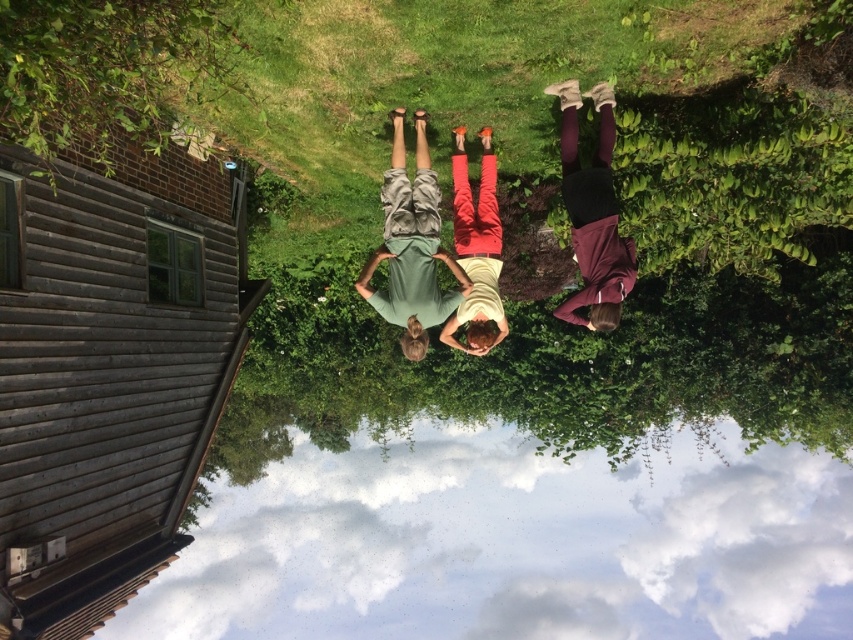
Is maroon fabric pants at center further to the viewer compared to matte yellow shirt at center?

No, it is in front of matte yellow shirt at center.

Does maroon fabric pants at center have a smaller size compared to matte yellow shirt at center?

Correct, maroon fabric pants at center occupies less space than matte yellow shirt at center.

Is point (573, 84) positioned after point (467, 244)?

No.

Locate an element on the screen. maroon fabric pants at center is located at coordinates (592, 212).

Does point (792, 456) come closer to viewer compared to point (601, 236)?

No, (792, 456) is behind (601, 236).

Which is below, transparent glass water at lower center or maroon fabric pants at center?

transparent glass water at lower center

You are a GUI agent. You are given a task and a screenshot of the screen. Output one action in this format:
    pyautogui.click(x=<x>, y=<y>)
    Task: Click on the transparent glass water at lower center
    Image resolution: width=853 pixels, height=640 pixels.
    Given the screenshot: What is the action you would take?
    pyautogui.click(x=503, y=532)

Can you confirm if green cotton shirt at center is taller than maroon fabric pants at center?

Correct, green cotton shirt at center is much taller as maroon fabric pants at center.

At what (x,y) coordinates should I click in order to perform the action: click on green cotton shirt at center. Please return your answer as a coordinate pair (x, y). Looking at the image, I should click on (410, 244).